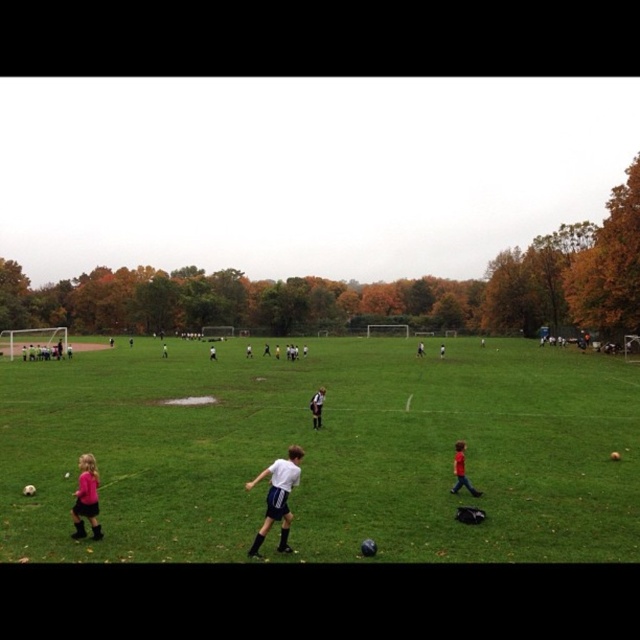
Between white matte shorts at center and white jersey at center, which one is positioned lower?

white jersey at center

Describe the element at coordinates (276, 497) in the screenshot. This screenshot has width=640, height=640. I see `white matte shorts at center` at that location.

Identify the location of white matte shorts at center. The height and width of the screenshot is (640, 640). (276, 497).

Between point (294, 458) and point (86, 465), which one is positioned behind?

Point (86, 465)

Does white matte shorts at center appear on the left side of pink matte dress at lower left?

Incorrect, white matte shorts at center is not on the left side of pink matte dress at lower left.

The height and width of the screenshot is (640, 640). Identify the location of white matte shorts at center. (276, 497).

Is point (84, 472) behind point (314, 396)?

No, it is not.

Is pink matte dress at lower left above white jersey at center?

Actually, pink matte dress at lower left is below white jersey at center.

Who is more forward, (83, 460) or (316, 412)?

Positioned in front is point (83, 460).

Where is `pink matte dress at lower left`? The width and height of the screenshot is (640, 640). pink matte dress at lower left is located at coordinates (x=86, y=499).